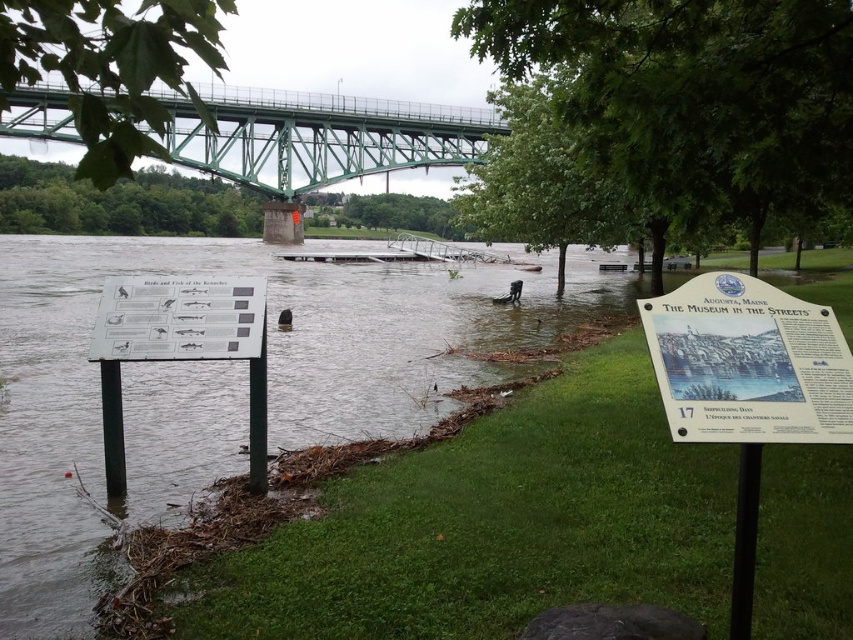
You are a photographer trying to capture both the white paper sign at lower right and the green steel bridge at upper center in a single frame. Given their heights, which object will appear smaller in your photo?

The white paper sign at lower right has a lesser height compared to the green steel bridge at upper center, so it will appear smaller in the photo.

You are a hiker trying to cross the green steel bridge at upper center but notice the flooded area. There is a white paper sign at lower right nearby. Which object is closer to you, the hiker, as you assess the situation?

The white paper sign at lower right is closer to the viewer than the green steel bridge at upper center, so the sign is closer to you as you assess the situation.